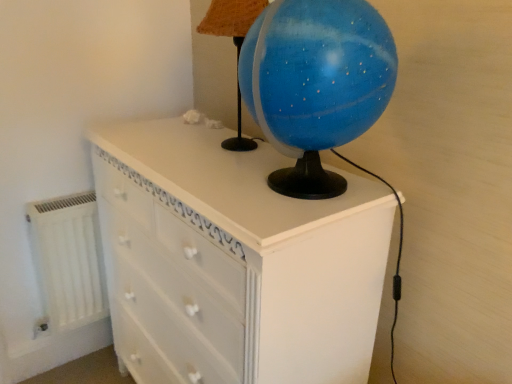
Question: Is white painted wood chest of drawers at center smaller than blue glossy globe at upper center?

Choices:
 (A) no
 (B) yes

Answer: (A)

Question: Is white painted wood chest of drawers at center outside blue glossy globe at upper center?

Choices:
 (A) no
 (B) yes

Answer: (B)

Question: Is white painted wood chest of drawers at center at the right side of blue glossy globe at upper center?

Choices:
 (A) no
 (B) yes

Answer: (A)

Question: Would you say blue glossy globe at upper center is part of white painted wood chest of drawers at center's contents?

Choices:
 (A) yes
 (B) no

Answer: (B)

Question: Is white painted wood chest of drawers at center not close to blue glossy globe at upper center?

Choices:
 (A) no
 (B) yes

Answer: (A)

Question: Looking at their shapes, would you say blue glossy globe at upper center is wider or thinner than white painted wood chest of drawers at center?

Choices:
 (A) wide
 (B) thin

Answer: (B)

Question: From a real-world perspective, is blue glossy globe at upper center above or below white painted wood chest of drawers at center?

Choices:
 (A) above
 (B) below

Answer: (A)

Question: Considering their positions, is blue glossy globe at upper center located in front of or behind white painted wood chest of drawers at center?

Choices:
 (A) behind
 (B) front

Answer: (A)

Question: Based on their positions, is blue glossy globe at upper center located to the left or right of white painted wood chest of drawers at center?

Choices:
 (A) left
 (B) right

Answer: (B)

Question: From a real-world perspective, is white matte radiator at lower left positioned above or below blue glossy globe at upper center?

Choices:
 (A) below
 (B) above

Answer: (A)

Question: Looking at their shapes, would you say white matte radiator at lower left is wider or thinner than blue glossy globe at upper center?

Choices:
 (A) wide
 (B) thin

Answer: (B)

Question: Would you say white matte radiator at lower left is inside or outside blue glossy globe at upper center?

Choices:
 (A) outside
 (B) inside

Answer: (A)

Question: Visually, is white matte radiator at lower left positioned to the left or to the right of blue glossy globe at upper center?

Choices:
 (A) left
 (B) right

Answer: (A)

Question: From the image's perspective, relative to white matte radiator at lower left, is white painted wood chest of drawers at center above or below?

Choices:
 (A) above
 (B) below

Answer: (B)

Question: Considering the positions of white painted wood chest of drawers at center and white matte radiator at lower left in the image, is white painted wood chest of drawers at center bigger or smaller than white matte radiator at lower left?

Choices:
 (A) small
 (B) big

Answer: (B)